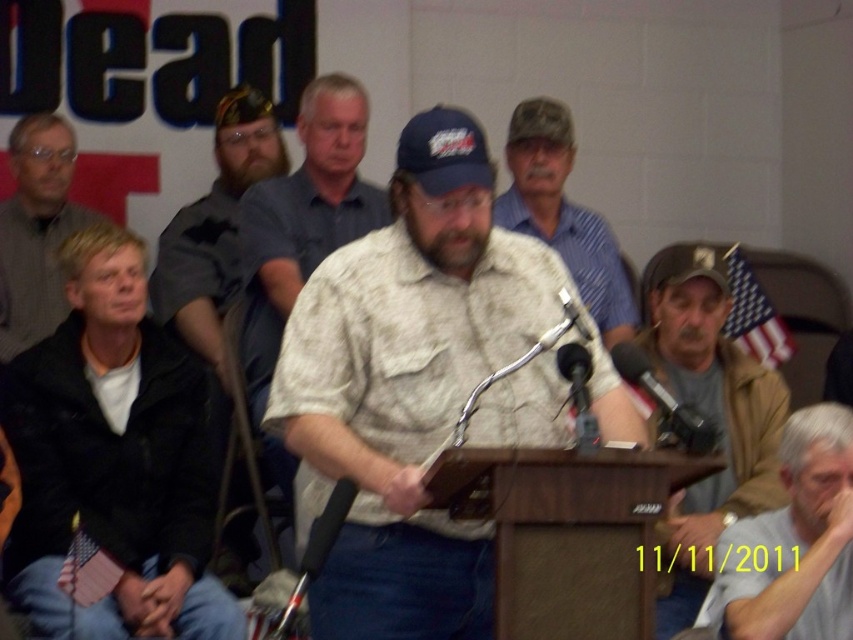
Is gray fabric shirt at lower right wider than camo fabric shirt at center?

No, gray fabric shirt at lower right is not wider than camo fabric shirt at center.

Between point (784, 458) and point (509, 228), which one is positioned behind?

Positioned behind is point (509, 228).

In order to click on gray fabric shirt at lower right in this screenshot , I will do 793,541.

Does black leather jacket at lower left have a greater width compared to american flag at center?

Yes, black leather jacket at lower left is wider than american flag at center.

Can you confirm if black leather jacket at lower left is positioned below american flag at center?

Indeed, black leather jacket at lower left is positioned under american flag at center.

Locate an element on the screen. black leather jacket at lower left is located at coordinates (114, 458).

I want to click on black leather jacket at lower left, so click(x=114, y=458).

Who is positioned more to the right, gray fabric shirt at lower right or american flag at center?

From the viewer's perspective, american flag at center appears more on the right side.

Measure the distance between point (807, 522) and camera.

Point (807, 522) is 3.00 meters from camera.

Does point (726, 576) come farther from viewer compared to point (769, 305)?

No, it is in front of (769, 305).

Locate an element on the screen. This screenshot has width=853, height=640. gray fabric shirt at lower right is located at coordinates (793, 541).